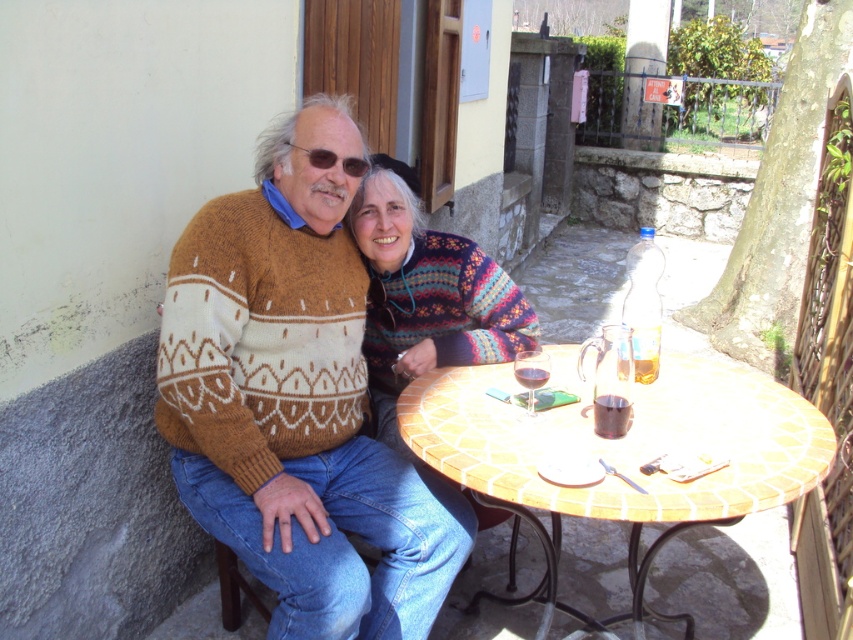
You are a tailor who needs to determine if the knitted sweater at left can fit into a storage box that is the same size as the translucent glass cup at table center. Based on the scene, can the sweater fit?

The knitted sweater at left is bigger than the translucent glass cup at table center, so it cannot fit into a storage box of the same size as the cup.

You are taking a photo of the two people at the table. You want to focus on the person closer to the camera. Which point should you use to adjust the focus? The options are point A at coordinates point (167, 317) and point B at coordinates point (596, 403).

Point A at coordinates point (167, 317) is further to the camera than point B at coordinates point (596, 403), so you should use point A to focus on the person closer to the camera.